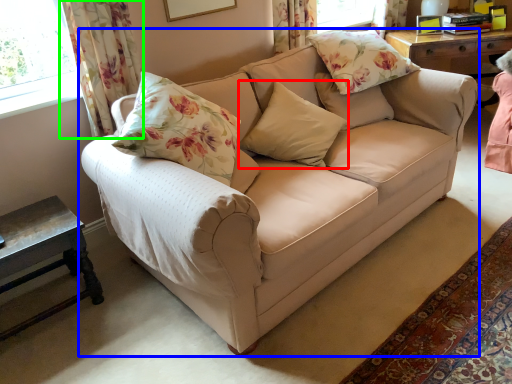
Question: Which object is the farthest from pillow (highlighted by a red box)? Choose among these: studio couch (highlighted by a blue box) or curtain (highlighted by a green box).

Choices:
 (A) studio couch
 (B) curtain

Answer: (B)